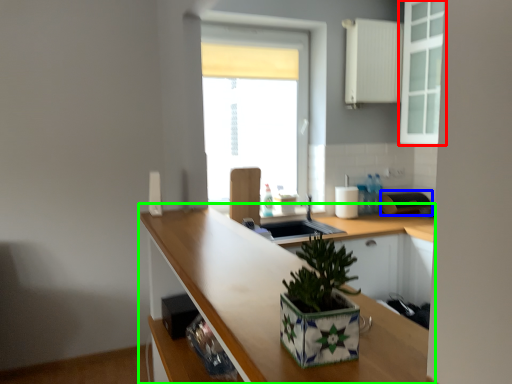
Question: Estimate the real-world distances between objects in this image. Which object is closer to cabinetry (highlighted by a red box), appliance (highlighted by a blue box) or countertop (highlighted by a green box)?

Choices:
 (A) appliance
 (B) countertop

Answer: (A)